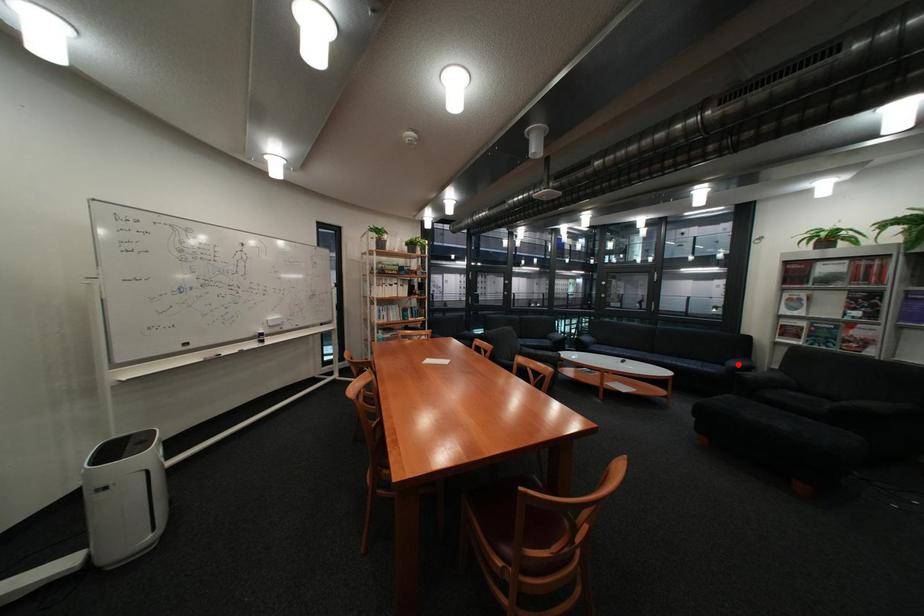
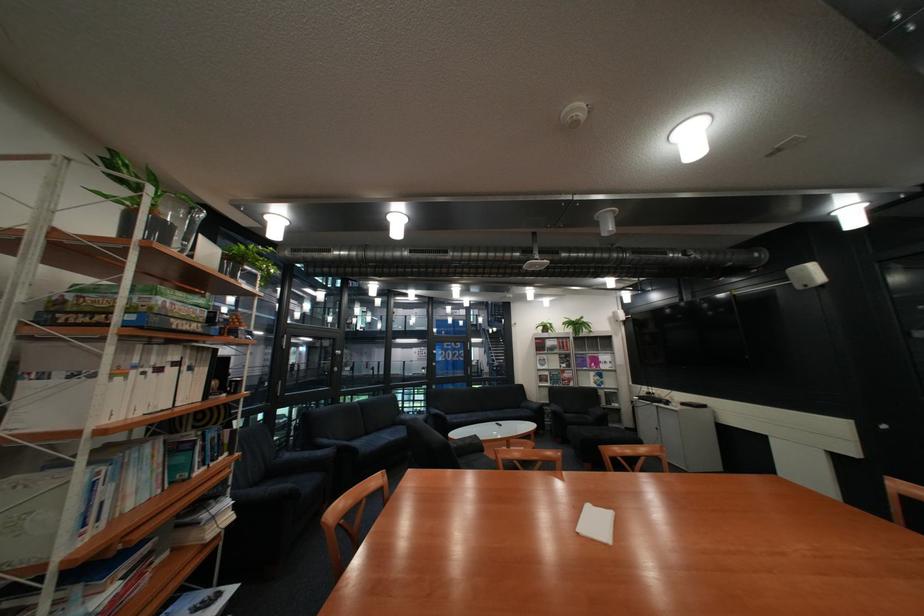
In the second image, find the point that corresponds to the highlighted location in the first image.

(535, 408)